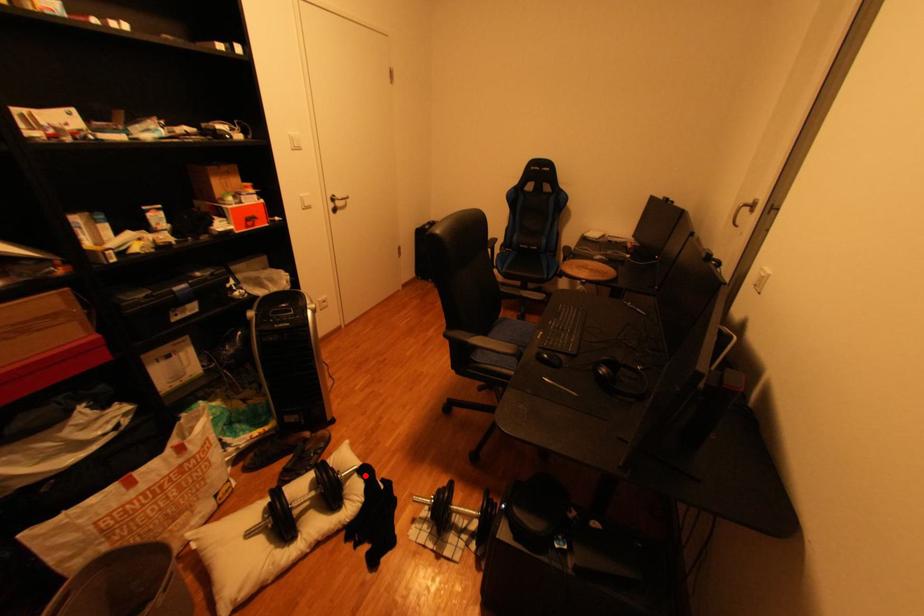
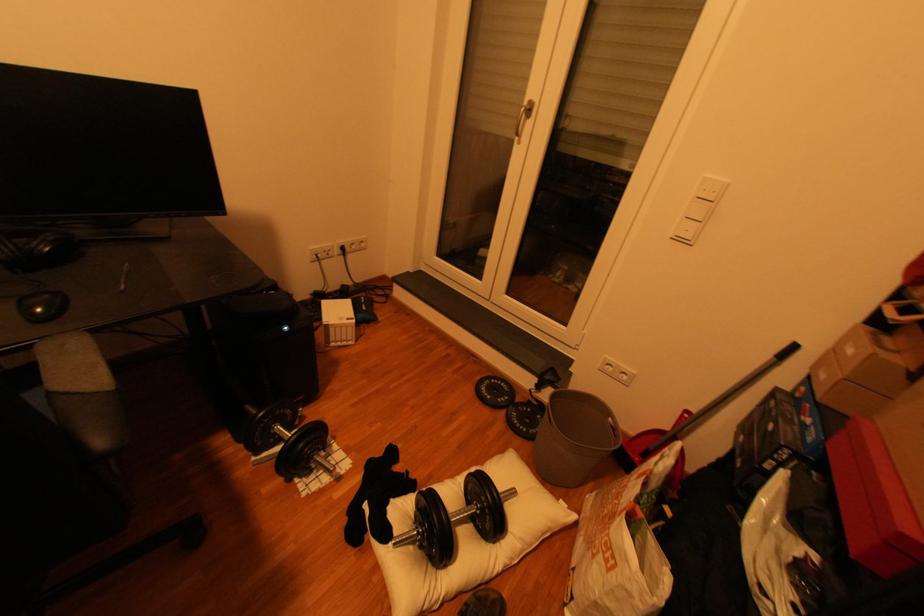
Question: I am providing you with two images of the same scene from different viewpoints. Image1 has a red point marked. In image2, the corresponding 3D location appears at what relative position? Reply with the corresponding letter.

Choices:
 (A) Closer
 (B) Farther

Answer: (B)